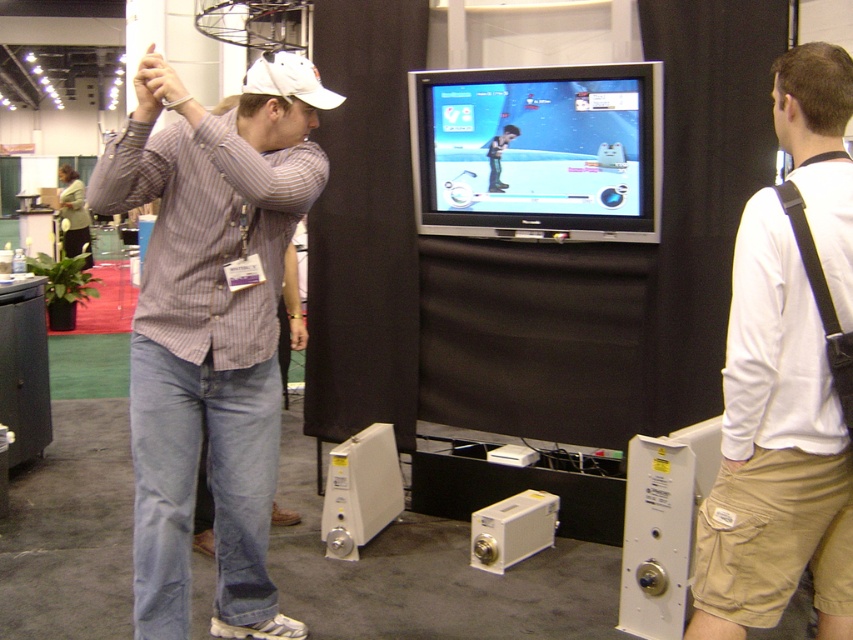
In the scene shown: You are a photographer at the exhibition hall. You need to take a photo of both the striped cotton shirt at center and the white cotton shirt at center. Which shirt should you focus on first if you want to capture the one that is taller?

The striped cotton shirt at center is taller than the white cotton shirt at center, so you should focus on the striped cotton shirt at center first to capture its height.